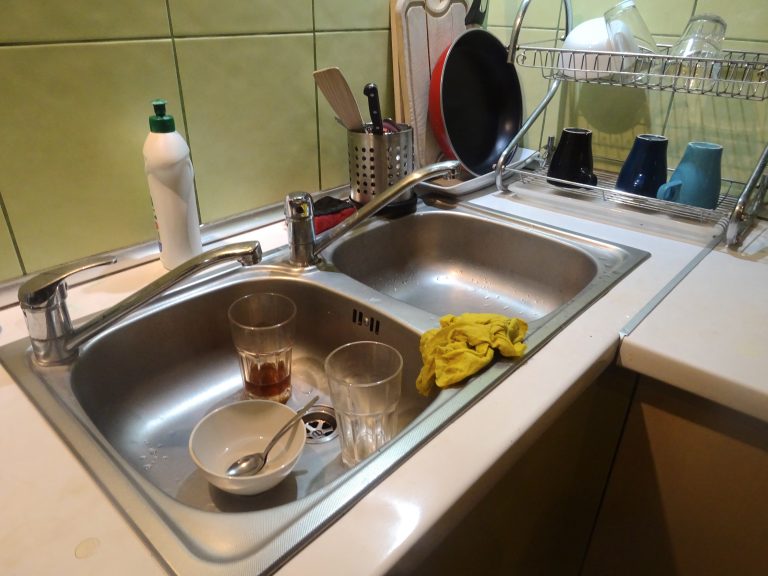
Where is `tile`? tile is located at coordinates (118, 112), (722, 113).